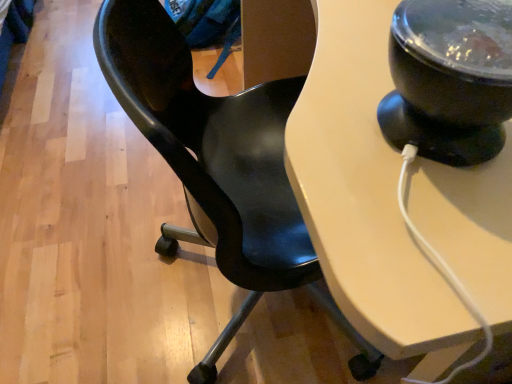
This screenshot has width=512, height=384. What are the coordinates of `vacant space underneath black plastic chair at center (from a real-world perspective)` in the screenshot? It's located at (244, 320).